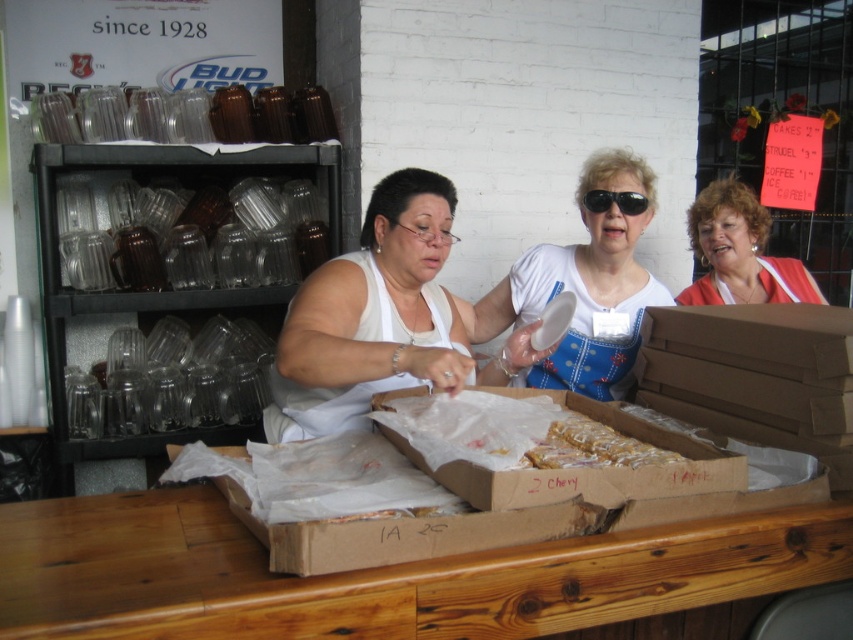
Question: Which point appears farthest from the camera in this image?

Choices:
 (A) (622, 260)
 (B) (780, 300)
 (C) (244, 605)
 (D) (550, 456)

Answer: (B)

Question: Is white fabric shirt at center wider than golden brown pastry at center?

Choices:
 (A) yes
 (B) no

Answer: (A)

Question: Is white fabric apron at upper right closer to camera compared to black plastic sunglasses at upper center?

Choices:
 (A) no
 (B) yes

Answer: (A)

Question: Based on their relative distances, which object is farther from the brown cardboard box at lower center?

Choices:
 (A) golden brown pastry at center
 (B) white fabric apron at upper right
 (C) white fabric apron at center
 (D) black plastic sunglasses at upper center

Answer: (B)

Question: Does brown cardboard box at lower center have a greater width compared to white fabric apron at upper right?

Choices:
 (A) no
 (B) yes

Answer: (B)

Question: Which point is farther to the camera?

Choices:
 (A) white fabric apron at upper right
 (B) wooden table at center

Answer: (A)